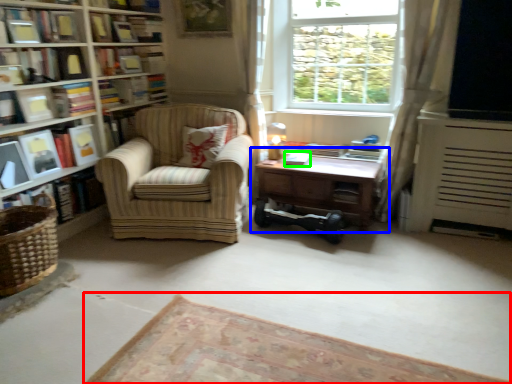
Question: Which object is the farthest from plain (highlighted by a red box)? Choose among these: table (highlighted by a blue box) or paperback book (highlighted by a green box).

Choices:
 (A) table
 (B) paperback book

Answer: (B)